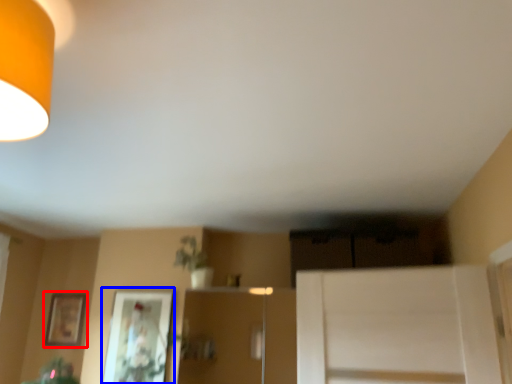
Question: Which point is closer to the camera, picture frame (highlighted by a red box) or picture frame (highlighted by a blue box)?

Choices:
 (A) picture frame
 (B) picture frame

Answer: (B)